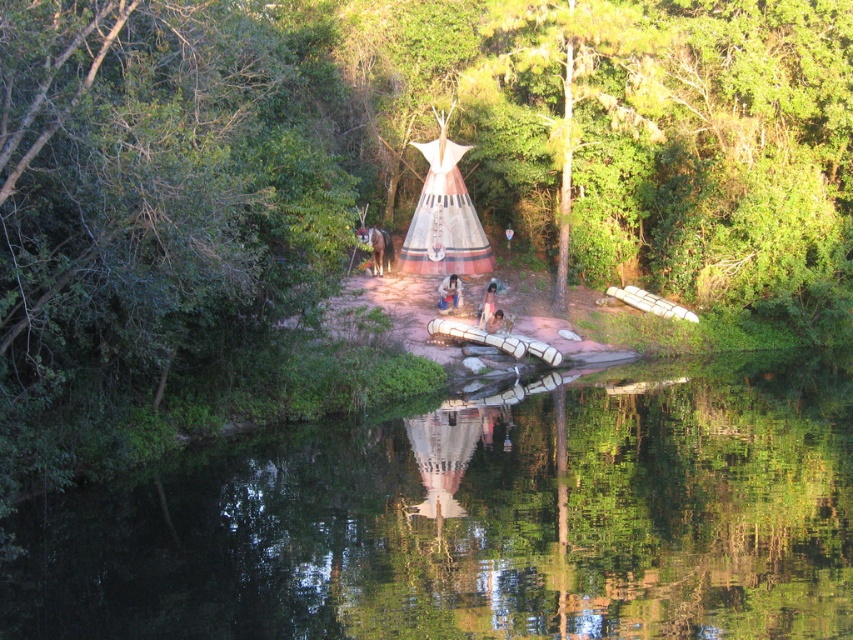
Question: Among these objects, which one is nearest to the camera?

Choices:
 (A) green leafy tree at center
 (B) brown leather jacket at center
 (C) tan skin person at center
 (D) green reflective water at center

Answer: (D)

Question: Can you confirm if green reflective water at center is positioned below green leafy tree at center?

Choices:
 (A) no
 (B) yes

Answer: (B)

Question: Observing the image, what is the correct spatial positioning of tan skin person at center in reference to brown leather jacket at center?

Choices:
 (A) right
 (B) left

Answer: (B)

Question: Does tan skin person at center have a greater width compared to brown leather jacket at center?

Choices:
 (A) yes
 (B) no

Answer: (B)

Question: Which object appears farthest from the camera in this image?

Choices:
 (A) brown fuzzy horse at center
 (B) brown leather jacket at center
 (C) green reflective water at center

Answer: (B)

Question: Based on their relative distances, which object is farther from the smooth skin face at center?

Choices:
 (A) tan skin person at center
 (B) green leafy tree at center
 (C) green reflective water at center
 (D) brown fuzzy horse at center

Answer: (C)